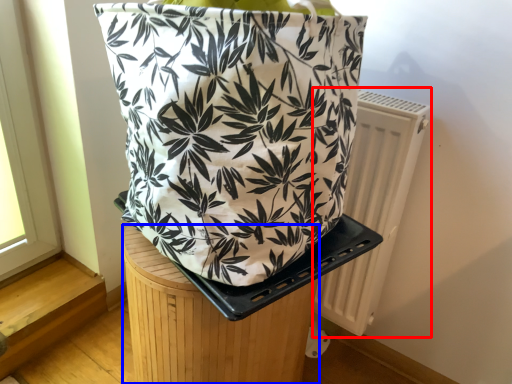
Question: Which of the following is the farthest to the observer, radiator (highlighted by a red box) or furniture (highlighted by a blue box)?

Choices:
 (A) radiator
 (B) furniture

Answer: (A)